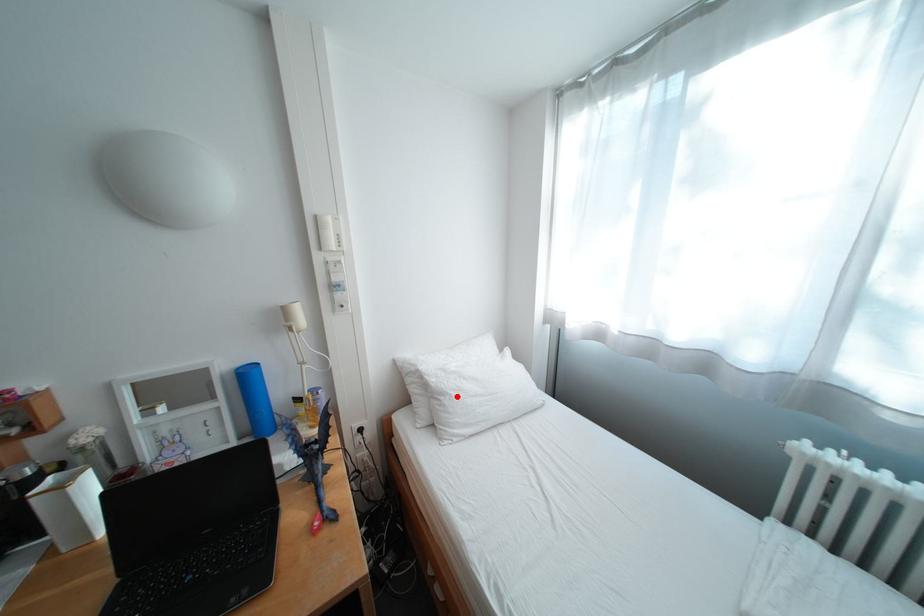
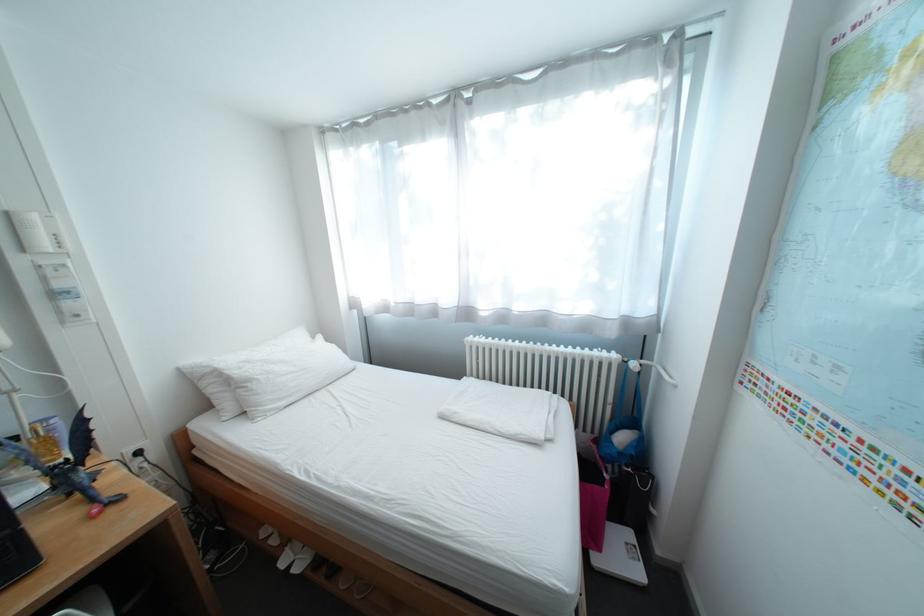
The point at the highlighted location is marked in the first image. Where is the corresponding point in the second image?

(263, 383)